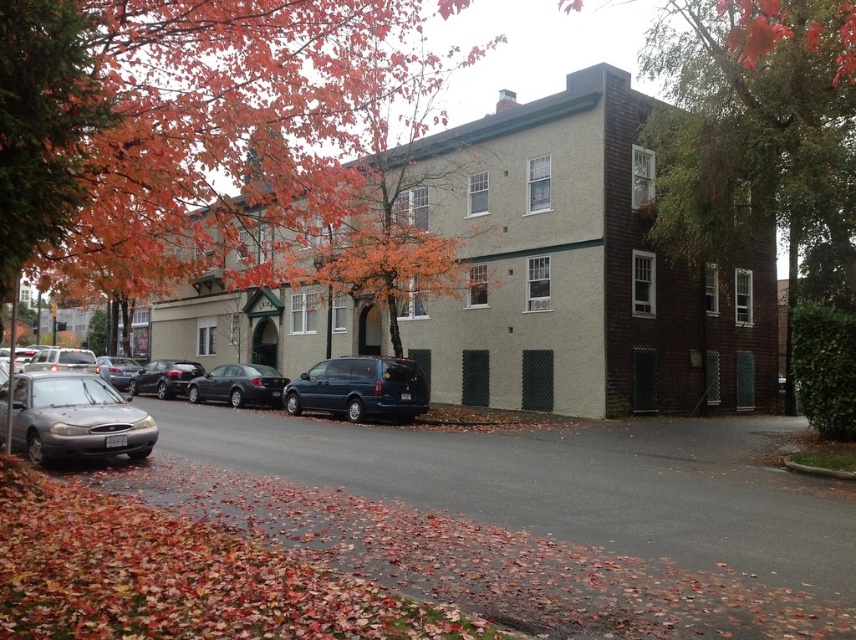
Question: Estimate the real-world distances between objects in this image. Which object is closer to the orange leafy tree at upper left?

Choices:
 (A) metallic blue minivan at center
 (B) orange leafy tree at left
 (C) shiny black sedan at center

Answer: (B)

Question: Considering the real-world distances, which object is closest to the shiny black sedan at center?

Choices:
 (A) silver metallic sedan at center-left
 (B) satin silver sedan at left
 (C) orange leafy tree at upper left
 (D) orange leafy tree at left

Answer: (A)

Question: Considering the relative positions of orange leafy tree at upper left and shiny black sedan at center in the image provided, where is orange leafy tree at upper left located with respect to shiny black sedan at center?

Choices:
 (A) above
 (B) below

Answer: (A)

Question: Does satin silver sedan at center appear over silver metallic sedan at center-left?

Choices:
 (A) no
 (B) yes

Answer: (A)

Question: Does satin silver sedan at left appear under silver metallic sedan at center-left?

Choices:
 (A) yes
 (B) no

Answer: (B)

Question: Which point is closer to the camera?

Choices:
 (A) (383, 403)
 (B) (128, 435)
 (C) (80, 410)
 (D) (113, 365)

Answer: (B)